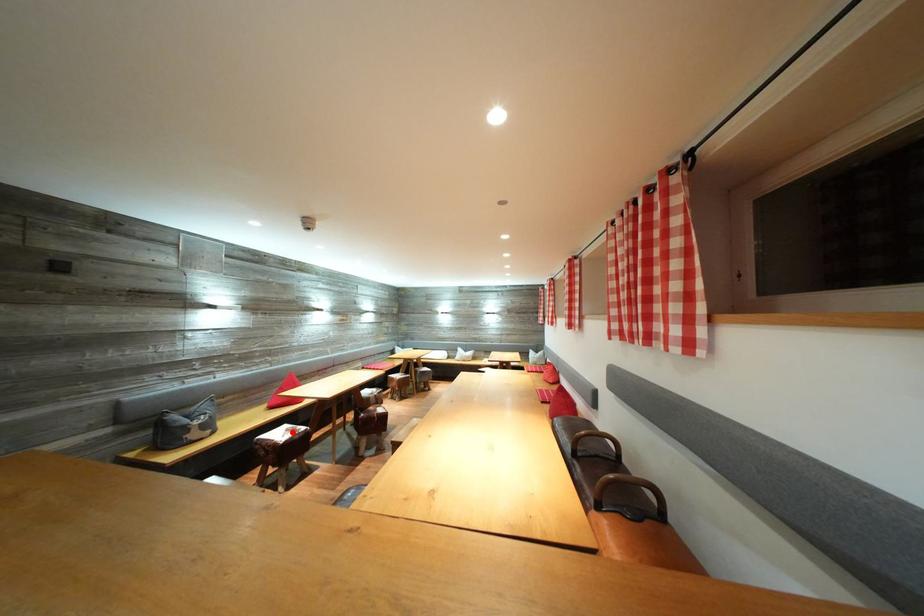
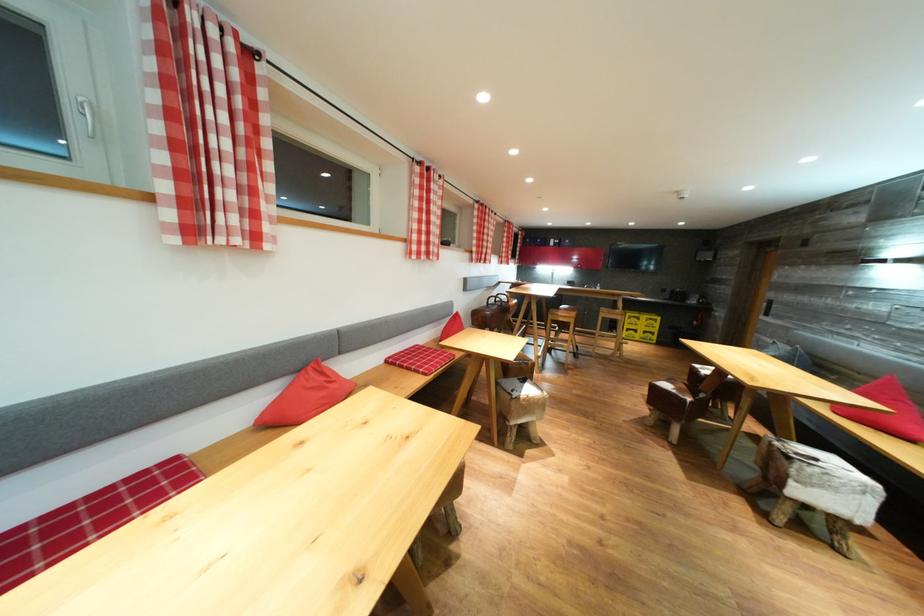
Question: I am providing you with two images of the same scene from different viewpoints. A red point is marked on the first image. Is the red point's position out of view in image 2?

Choices:
 (A) Yes
 (B) No

Answer: (A)